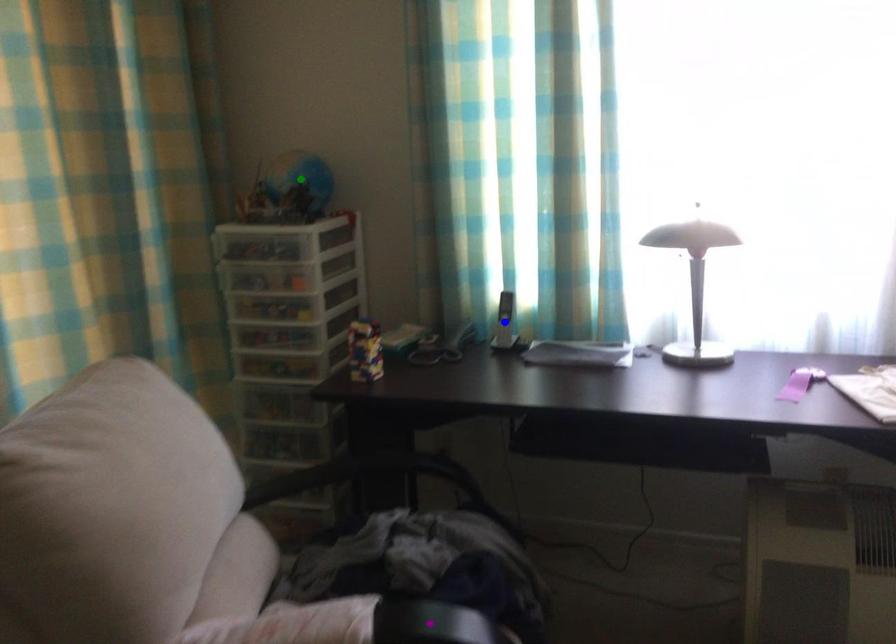
Looking at this image, order these from farthest to nearest:
blue point | purple point | green point

1. green point
2. blue point
3. purple point